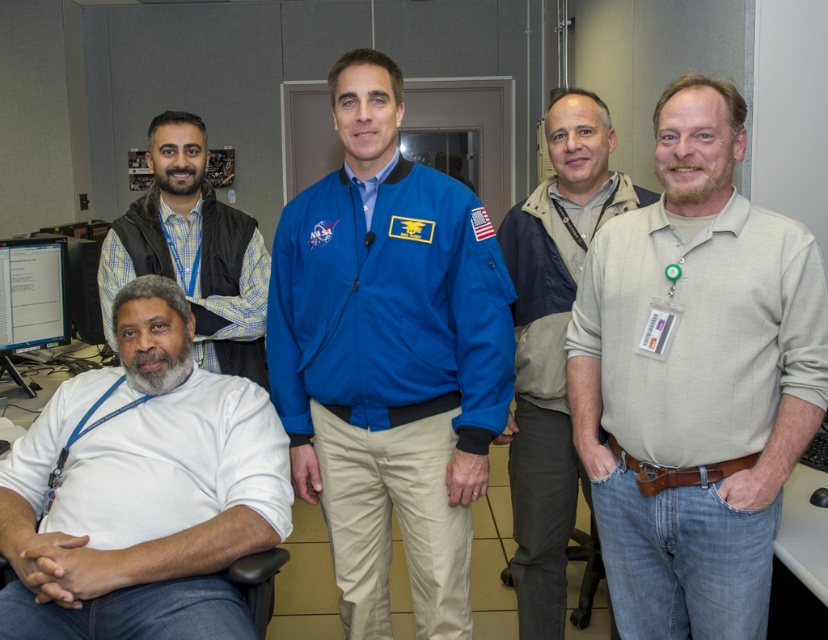
From the picture: You are an office security guard checking the coordinates of all items. According to the scene, where is the matte black vest at left positioned?

The matte black vest at left is located at point (195, 250).

You are an office worker who needs to reach the door in the background. There is a blue fabric jacket at center and a matte black vest at left in your way. Which object should you move around to reach the door?

The blue fabric jacket at center is in front of the matte black vest at left, so you should move around the blue fabric jacket at center to reach the door.